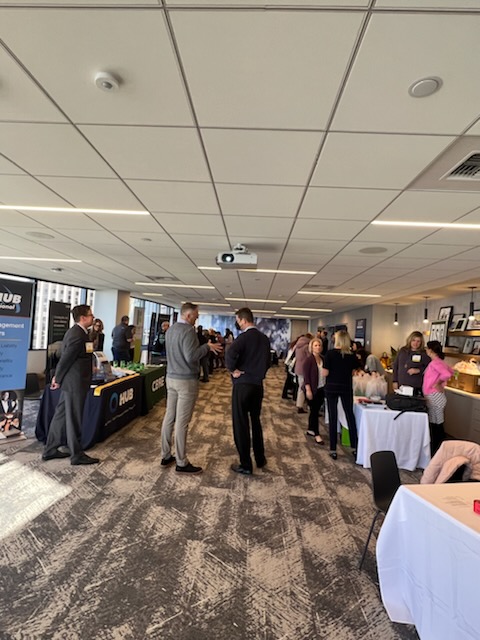
You are a GUI agent. You are given a task and a screenshot of the screen. Output one action in this format:
    pyautogui.click(x=<x>, y=<y>)
    Task: Click on the grey carpet
    The width and height of the screenshot is (480, 640).
    Given the screenshot: What is the action you would take?
    pyautogui.click(x=152, y=586)